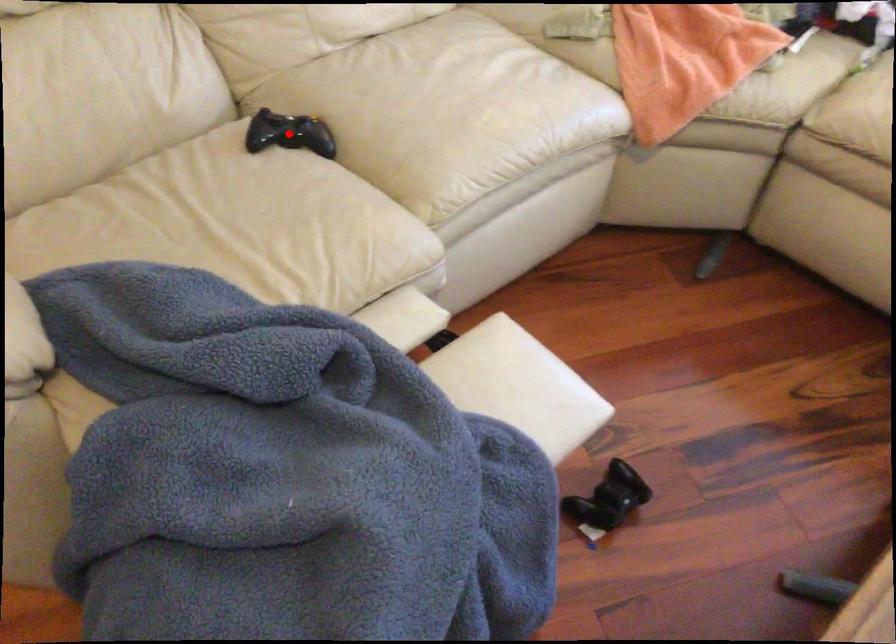
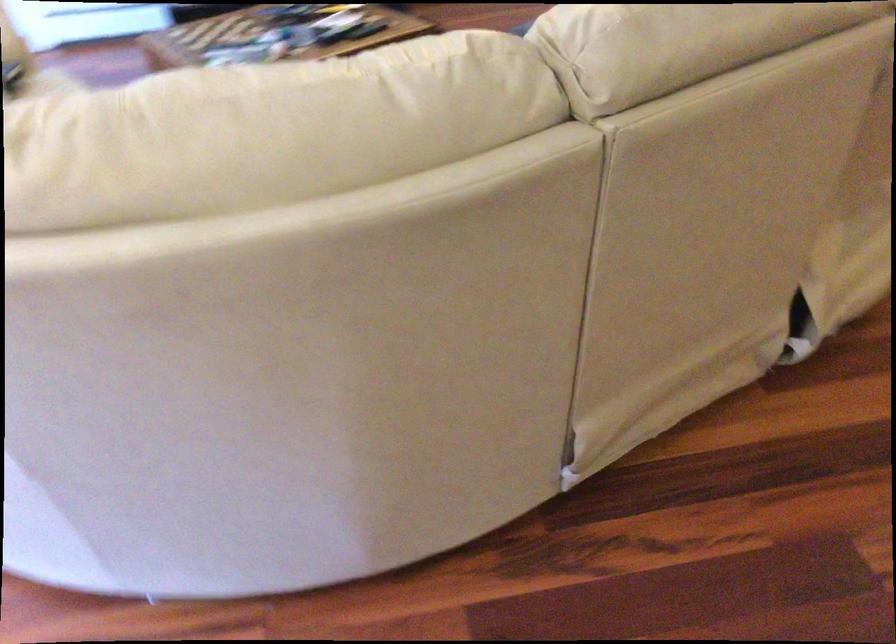
Question: I am providing you with two images of the same scene from different viewpoints. A red point is marked on the first image. At the location where the point appears in image 1, is it still visible in image 2?

Choices:
 (A) Yes
 (B) No

Answer: (B)